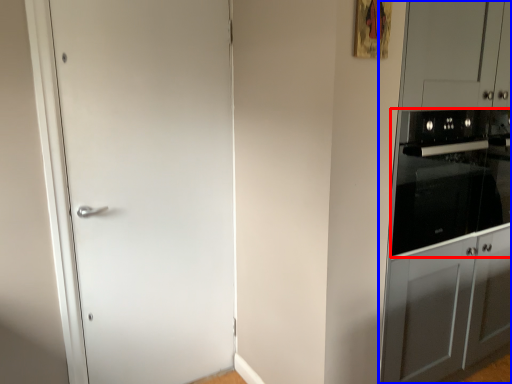
Question: Which point is closer to the camera, home appliance (highlighted by a red box) or dresser (highlighted by a blue box)?

Choices:
 (A) home appliance
 (B) dresser

Answer: (B)